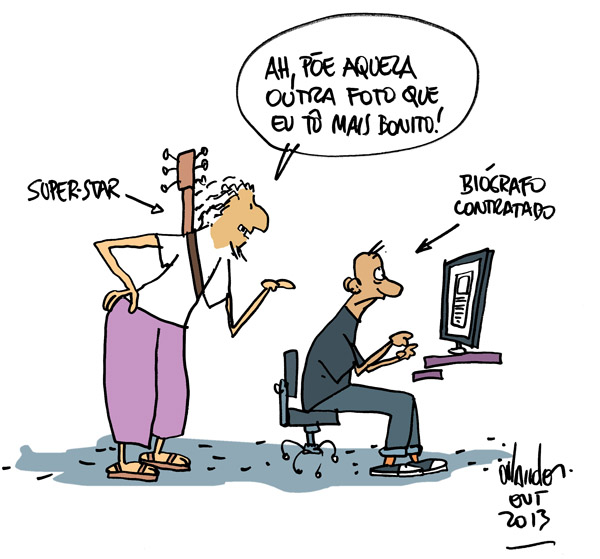
This screenshot has height=559, width=600. What are the coordinates of `desk chair` in the screenshot? It's located at (297, 404).